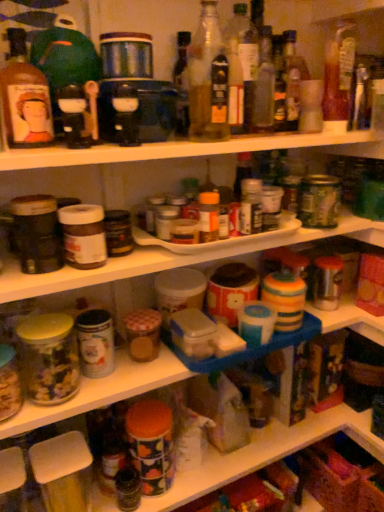
Question: Considering the positions of translucent glass bottle at upper right, the sixth bottle when ordered from left to right, and translucent glass bottle at upper center, positioned as the fourth bottle in right-to-left order, in the image, is translucent glass bottle at upper right, the sixth bottle when ordered from left to right, taller or shorter than translucent glass bottle at upper center, positioned as the fourth bottle in right-to-left order,?

Choices:
 (A) tall
 (B) short

Answer: (A)

Question: Considering the positions of translucent glass bottle at upper right, the sixth bottle when ordered from left to right, and translucent glass bottle at upper center, the third bottle in the left-to-right sequence, in the image, is translucent glass bottle at upper right, the sixth bottle when ordered from left to right, wider or thinner than translucent glass bottle at upper center, the third bottle in the left-to-right sequence,?

Choices:
 (A) thin
 (B) wide

Answer: (B)

Question: Estimate the real-world distances between objects in this image. Which object is closer to the matte black blender at upper center?

Choices:
 (A) matte glass bottle at upper left, placed as the first bottle when sorted from left to right
 (B) translucent glass bottle at upper right, which is the first bottle in right-to-left order
 (C) translucent glass jar at left
 (D) translucent glass bottle at upper center, which is the second bottle in right-to-left order
 (E) translucent glass bottle at upper center, the third bottle in the left-to-right sequence

Answer: (A)

Question: Which object is positioned farthest from the matte glass bottle at upper left, the 6th bottle in the right-to-left sequence?

Choices:
 (A) translucent glass bottle at upper center, the 5th bottle viewed from the right
 (B) translucent glass bottle at upper center, positioned as the fourth bottle in right-to-left order
 (C) translucent glass bottle at center, placed as the third bottle when sorted from right to left
 (D) translucent glass bottle at upper center, acting as the fifth bottle starting from the left
 (E) matte black blender at upper center

Answer: (D)